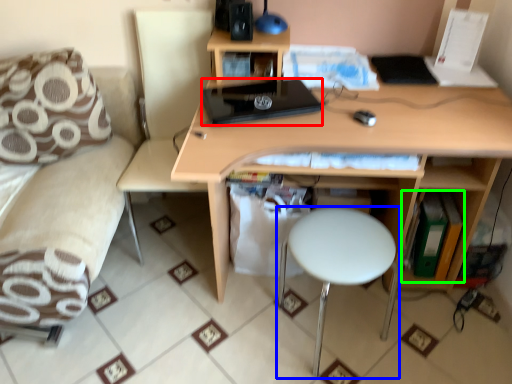
Question: Which object is the closest to the laptop (highlighted by a red box)? Choose among these: stool (highlighted by a blue box) or book (highlighted by a green box).

Choices:
 (A) stool
 (B) book

Answer: (A)